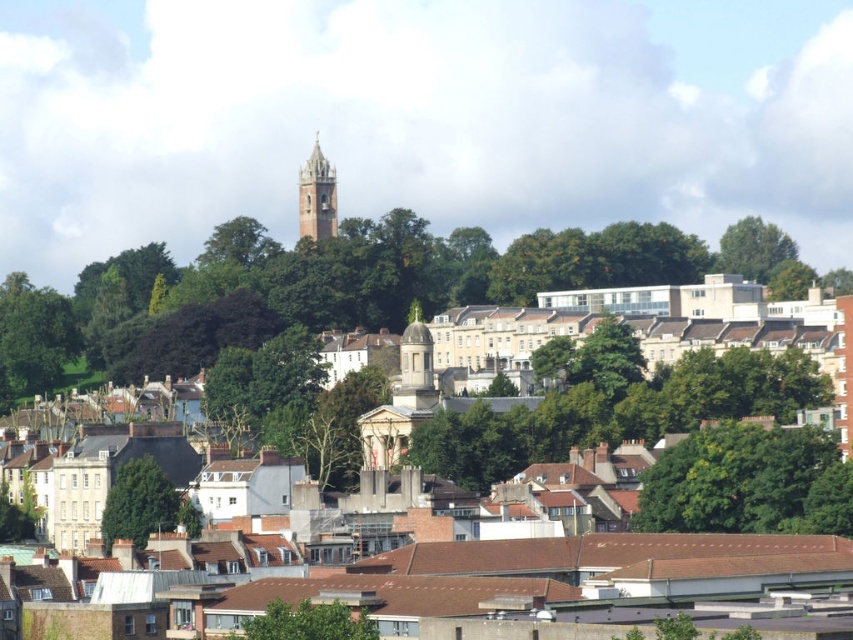
Question: Is green leafy tree at center closer to the viewer compared to green leafy tree at upper right?

Choices:
 (A) no
 (B) yes

Answer: (B)

Question: Can you confirm if green leafy tree at lower left is positioned to the right of smooth stone bell tower at center?

Choices:
 (A) no
 (B) yes

Answer: (A)

Question: Which point is closer to the camera?

Choices:
 (A) green leafy tree at left
 (B) white stone dome at center
 (C) green leafy tree at lower center

Answer: (C)

Question: Based on their relative distances, which object is nearer to the green leafy tree at center?

Choices:
 (A) white stone dome at center
 (B) green leafy tree at lower center
 (C) green leafy tree at upper right

Answer: (A)

Question: Is white stone church at center wider than green leafy tree at lower left?

Choices:
 (A) yes
 (B) no

Answer: (A)

Question: Estimate the real-world distances between objects in this image. Which object is farther from the green leafy tree at lower center?

Choices:
 (A) green leafy tree at center
 (B) white stone dome at center
 (C) white stone church at center

Answer: (B)